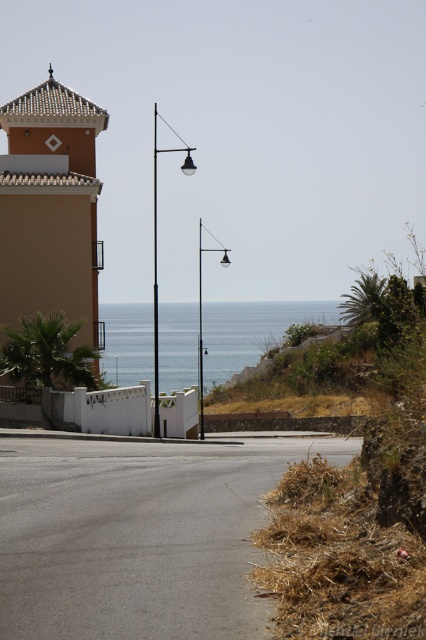
Question: Is matte orange building at upper left below blue water at center?

Choices:
 (A) no
 (B) yes

Answer: (A)

Question: Which point is closer to the camera?

Choices:
 (A) blue water at center
 (B) matte orange building at upper left

Answer: (B)

Question: Which of the following is the closest to the observer?

Choices:
 (A) (250, 352)
 (B) (86, 276)

Answer: (B)

Question: Does matte orange building at upper left have a smaller size compared to blue water at center?

Choices:
 (A) yes
 (B) no

Answer: (A)

Question: Which point appears closest to the camera in this image?

Choices:
 (A) (181, 314)
 (B) (22, 152)

Answer: (B)

Question: Is matte orange building at upper left smaller than blue water at center?

Choices:
 (A) no
 (B) yes

Answer: (B)